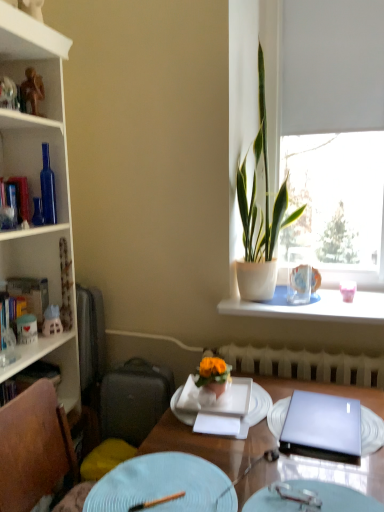
What are the coordinates of `hardcover book at left, which appears as the second book when viewed from the top` in the screenshot? It's located at (30, 295).

This screenshot has width=384, height=512. Find the location of `white glossy cabinet at upper left`. white glossy cabinet at upper left is located at coordinates (29, 37).

This screenshot has height=512, width=384. What do you see at coordinates (29, 37) in the screenshot?
I see `white glossy cabinet at upper left` at bounding box center [29, 37].

The height and width of the screenshot is (512, 384). What do you see at coordinates (348, 290) in the screenshot? I see `matte pink vase at window, placed as the first tableware when sorted from right to left` at bounding box center [348, 290].

In order to face white glossy plate at center, the first plate from the back, should I rotate leftwards or rightwards?

Turn right by 4.095 degrees to look at white glossy plate at center, the first plate from the back.

What do you see at coordinates (312, 307) in the screenshot? The height and width of the screenshot is (512, 384). I see `white ceramic vase at upper right` at bounding box center [312, 307].

The width and height of the screenshot is (384, 512). Find the location of `hardcover book at left, acting as the 1th book starting from the bottom`. hardcover book at left, acting as the 1th book starting from the bottom is located at coordinates (28, 379).

Identify the location of hardcover book at left, which is the 2th book in bottom-to-top order. (30, 295).

Is white glossy cabinet at upper left not inside light blue ceramic plate at center, marked as the 2th plate in a front-to-back arrangement?

Indeed, white glossy cabinet at upper left is completely outside light blue ceramic plate at center, marked as the 2th plate in a front-to-back arrangement.

Considering the sizes of objects white glossy cabinet at upper left and light blue ceramic plate at center, which is the 2th plate from back to front, in the image provided, who is smaller, white glossy cabinet at upper left or light blue ceramic plate at center, which is the 2th plate from back to front,?

light blue ceramic plate at center, which is the 2th plate from back to front, is smaller.

Are white glossy cabinet at upper left and light blue ceramic plate at center, which is the 2th plate from back to front, located far from each other?

Yes, white glossy cabinet at upper left and light blue ceramic plate at center, which is the 2th plate from back to front, are located far from each other.

Which object is thinner, satin purple laptop at center or white glossy plate at center, the first plate from the back?

With smaller width is satin purple laptop at center.

Looking at this image, considering the relative positions of satin purple laptop at center and white glossy plate at center, which is the third plate from front to back, in the image provided, is satin purple laptop at center to the left of white glossy plate at center, which is the third plate from front to back, from the viewer's perspective?

Incorrect, satin purple laptop at center is not on the left side of white glossy plate at center, which is the third plate from front to back.

Is satin purple laptop at center further to camera compared to white glossy plate at center, the first plate from the back?

No, it is not.

Is white glossy plate at center, the first plate from the back, a part of satin purple laptop at center?

Definitely not — white glossy plate at center, the first plate from the back, is not inside satin purple laptop at center.

From a real-world perspective, is wooden table at center physically located above or below white paper at center?

From a real-world perspective, wooden table at center is physically below white paper at center.

Which of these two, wooden table at center or white paper at center, stands taller?

wooden table at center is taller.

Between wooden table at center and white paper at center, which one has smaller size?

white paper at center.

Which of these two, wooden table at center or white paper at center, is wider?

wooden table at center.

Is metallic silver fork at center, marked as the 2th tableware in a top-to-bottom arrangement, taller or shorter than hardcover book at left, which appears as the second book when viewed from the top?

In the image, metallic silver fork at center, marked as the 2th tableware in a top-to-bottom arrangement, appears to be shorter than hardcover book at left, which appears as the second book when viewed from the top.

How much distance is there between metallic silver fork at center, marked as the 2th tableware in a top-to-bottom arrangement, and hardcover book at left, which is the 2th book in bottom-to-top order?

metallic silver fork at center, marked as the 2th tableware in a top-to-bottom arrangement, and hardcover book at left, which is the 2th book in bottom-to-top order, are 1.35 meters apart from each other.

In the image, is metallic silver fork at center, which appears as the 2th tableware when viewed from the left, positioned in front of or behind hardcover book at left, which appears as the second book when viewed from the top?

metallic silver fork at center, which appears as the 2th tableware when viewed from the left, is in front of hardcover book at left, which appears as the second book when viewed from the top.

You are a GUI agent. You are given a task and a screenshot of the screen. Output one action in this format:
    pyautogui.click(x=<x>, y=<y>)
    Task: Click on the 1st book directly above the metallic silver fork at center, which appears as the 2th tableware when viewed from the left (from a real-world perspective)
    
    Given the screenshot: What is the action you would take?
    pyautogui.click(x=30, y=295)

Can you confirm if satin purple laptop at center is shorter than gold metallic figurine at upper left?

Indeed, satin purple laptop at center has a lesser height compared to gold metallic figurine at upper left.

Is satin purple laptop at center in contact with gold metallic figurine at upper left?

No, satin purple laptop at center is not in contact with gold metallic figurine at upper left.

From the picture: Which of these two, satin purple laptop at center or gold metallic figurine at upper left, is thinner?

gold metallic figurine at upper left.

Does gold metallic figurine at upper left have a greater height compared to metallic silver fork at center, the 2th tableware positioned from the front?

Correct, gold metallic figurine at upper left is much taller as metallic silver fork at center, the 2th tableware positioned from the front.

How distant is gold metallic figurine at upper left from metallic silver fork at center, the second tableware in the back-to-front sequence?

A: They are 5.47 feet apart.

From a real-world perspective, which is physically below, gold metallic figurine at upper left or metallic silver fork at center, marked as the 2th tableware in a top-to-bottom arrangement?

metallic silver fork at center, marked as the 2th tableware in a top-to-bottom arrangement, from a real-world perspective.

Between gold metallic figurine at upper left and metallic silver fork at center, the second tableware in the back-to-front sequence, which one appears on the right side from the viewer's perspective?

metallic silver fork at center, the second tableware in the back-to-front sequence, is more to the right.

Considering the relative positions of light blue ceramic plate at center, which is the 2th plate from back to front, and wooden chopstick at lower center, acting as the 3th tableware starting from the back, in the image provided, is light blue ceramic plate at center, which is the 2th plate from back to front, to the left of wooden chopstick at lower center, acting as the 3th tableware starting from the back, from the viewer's perspective?

In fact, light blue ceramic plate at center, which is the 2th plate from back to front, is to the right of wooden chopstick at lower center, acting as the 3th tableware starting from the back.

Is the surface of light blue ceramic plate at center, marked as the 2th plate in a front-to-back arrangement, in direct contact with wooden chopstick at lower center, the 3th tableware viewed from the top?

Yes, light blue ceramic plate at center, marked as the 2th plate in a front-to-back arrangement, is in contact with wooden chopstick at lower center, the 3th tableware viewed from the top.

At what (x,y) coordinates should I click in order to perform the action: click on tableware that is on the left side of light blue ceramic plate at center, marked as the 2th plate in a front-to-back arrangement. Please return your answer as a coordinate pair (x, y). This screenshot has width=384, height=512. Looking at the image, I should click on (156, 502).

Considering the positions of point (232, 497) and point (149, 501), is point (232, 497) closer or farther from the camera than point (149, 501)?

Clearly, point (232, 497) is more distant from the camera than point (149, 501).

In order to click on the 2nd plate in front of the white glossy cabinet at upper left in this screenshot , I will do `click(163, 485)`.

Where is `laptop located above the white glossy plate at center, which is the third plate from front to back (from a real-world perspective)`? This screenshot has height=512, width=384. laptop located above the white glossy plate at center, which is the third plate from front to back (from a real-world perspective) is located at coordinates point(323,422).

Estimate the real-world distances between objects in this image. Which object is closer to wooden chopstick at lower center, positioned as the first tableware in front-to-back order, satin purple laptop at center or white matte window at upper right?

satin purple laptop at center is positioned closer to the anchor wooden chopstick at lower center, positioned as the first tableware in front-to-back order.

Estimate the real-world distances between objects in this image. Which object is closer to hardcover book at left, acting as the 1th book starting from the bottom, light blue ceramic plate at center, which is the 2th plate from back to front, or white paper at center?

light blue ceramic plate at center, which is the 2th plate from back to front.

Estimate the real-world distances between objects in this image. Which object is closer to light blue ceramic plate at center, which is the 2th plate from back to front, light blue textured plate at lower center, the 3th plate from the back, or white plastic radiator at lower center?

light blue textured plate at lower center, the 3th plate from the back, lies closer to light blue ceramic plate at center, which is the 2th plate from back to front, than the other object.

Based on their spatial positions, is satin purple laptop at center or light blue ceramic plate at center, marked as the 2th plate in a front-to-back arrangement, further from white glossy plate at center, the first plate from the back?

Based on the image, light blue ceramic plate at center, marked as the 2th plate in a front-to-back arrangement, appears to be further to white glossy plate at center, the first plate from the back.

Looking at the image, which one is located further to green leafy plant at window, metallic silver fork at center, the second tableware in the back-to-front sequence, or white glossy bookcase at left?

Based on the image, metallic silver fork at center, the second tableware in the back-to-front sequence, appears to be further to green leafy plant at window.

Based on their spatial positions, is white ceramic vase at upper right or green leafy plant at window closer to light blue textured plate at lower center, which appears as the first plate when viewed from the front?

white ceramic vase at upper right is positioned closer to the anchor light blue textured plate at lower center, which appears as the first plate when viewed from the front.

Which object lies nearer to the anchor point white matte window at upper right, green leafy plant at window or white glossy bookcase at left?

green leafy plant at window is closer to white matte window at upper right.

Consider the image. When comparing their distances from satin purple laptop at center, does white ceramic vase at upper right or white glossy cabinet at upper left seem further?

white glossy cabinet at upper left lies further to satin purple laptop at center than the other object.

Where is `laptop between light blue textured plate at lower center, which appears as the first plate when viewed from the front, and white paper at center, along the z-axis`? The image size is (384, 512). laptop between light blue textured plate at lower center, which appears as the first plate when viewed from the front, and white paper at center, along the z-axis is located at coordinates (323, 422).

Where is `tableware between white glossy plate at center, the first plate from the back, and satin purple laptop at center, in the horizontal direction`? tableware between white glossy plate at center, the first plate from the back, and satin purple laptop at center, in the horizontal direction is located at coordinates (296, 495).

The height and width of the screenshot is (512, 384). Find the location of `plate located between satin purple laptop at center and matte pink vase at window, the 1th tableware viewed from the top, in the depth direction`. plate located between satin purple laptop at center and matte pink vase at window, the 1th tableware viewed from the top, in the depth direction is located at coordinates (257, 405).

At what (x,y) coordinates should I click in order to perform the action: click on book between light blue textured plate at lower center, the 3th plate from the back, and hardcover book at left, acting as the 1th book starting from the bottom, in the front-back direction. Please return your answer as a coordinate pair (x, y). The height and width of the screenshot is (512, 384). Looking at the image, I should click on (19, 197).